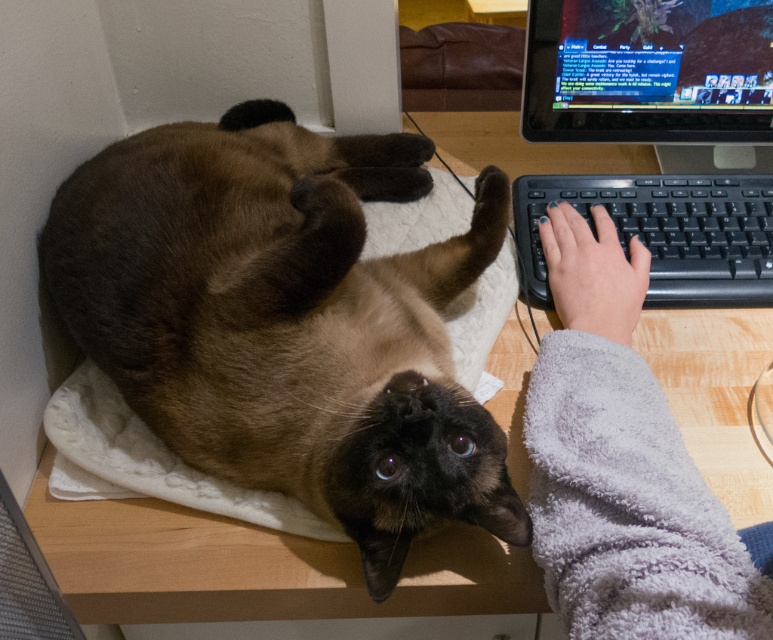
Looking at this image, you are a cat owner who wants to ensure your satin brown cat at center has enough space to move around on the wooden desk. Considering the gray fuzzy sleeve at lower right is also present, can you determine if the cat has enough space?

The satin brown cat at center has a larger size compared to gray fuzzy sleeve at lower right, so there might not be enough space for the cat to move around comfortably if the sleeve is occupying part of the desk.

Based on the photo, you are a cat owner who wants to ensure your satin brown cat at center stays safe while you work at your desk. The shiny plastic monitor at upper right has a sharp edge. Is the cat positioned in a way that it can avoid the monitor?

The satin brown cat at center is closer to the viewer than the shiny plastic monitor at upper right, so the cat is positioned away from the monitor and its sharp edge, making it safer for the cat to lounge there.

Looking at this image, you are standing in front of the desk and want to reach the point at coordinates [94,266]. The cat is on the white towel. Can you safely reach that point without disturbing the cat?

The point at coordinates [94,266] is 28.82 inches away from the viewer, so you can safely reach it without disturbing the cat on the white towel.